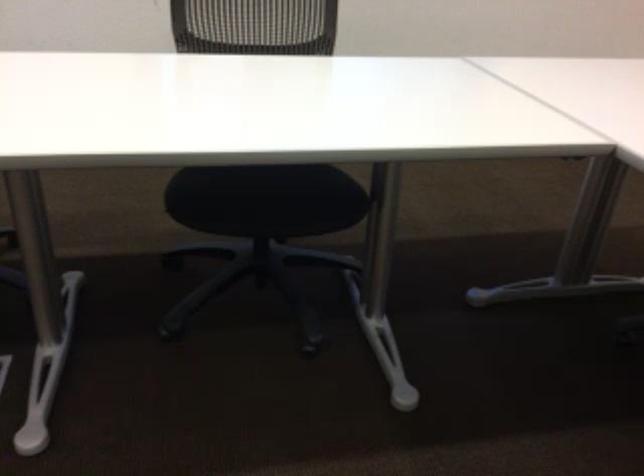
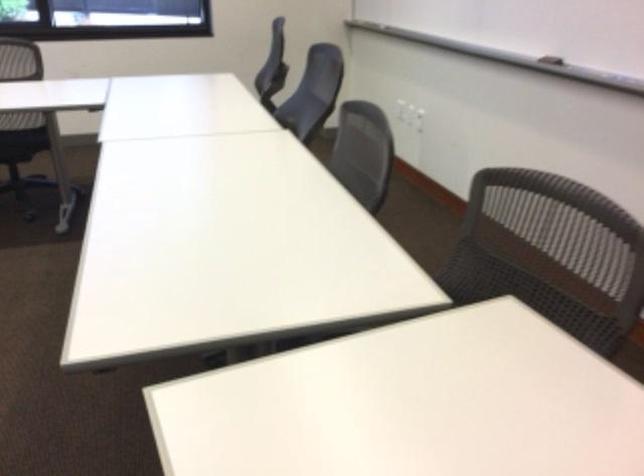
Locate, in the second image, the point that corresponds to point 348,184 in the first image.

(22, 143)